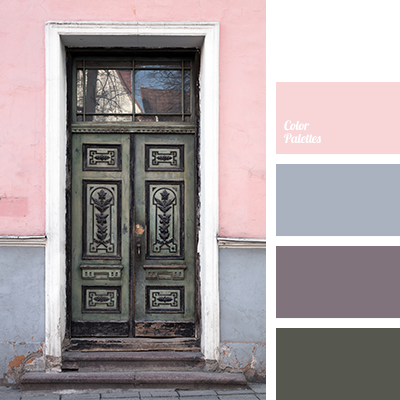
Locate an element on the screen. crack in plaster is located at coordinates (233, 359), (251, 353).